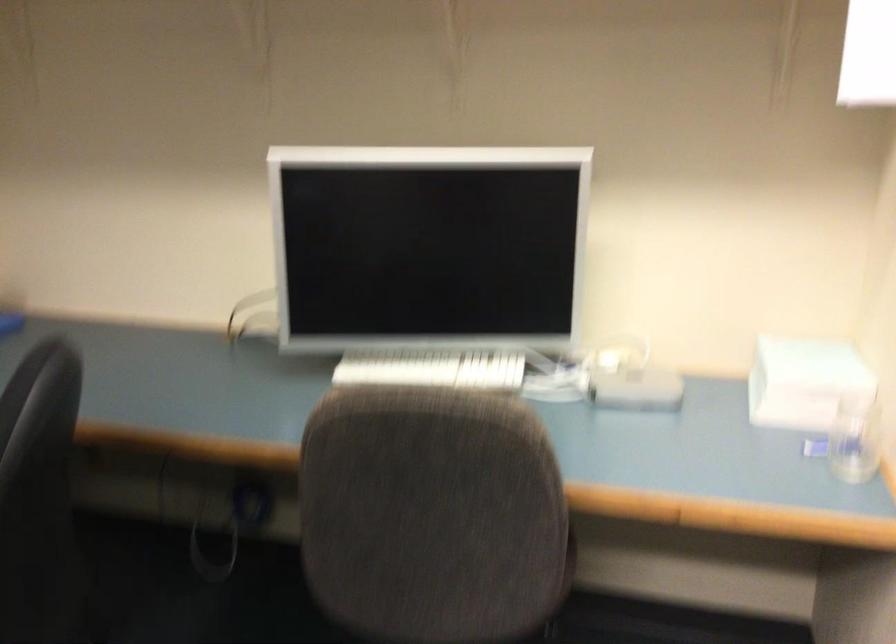
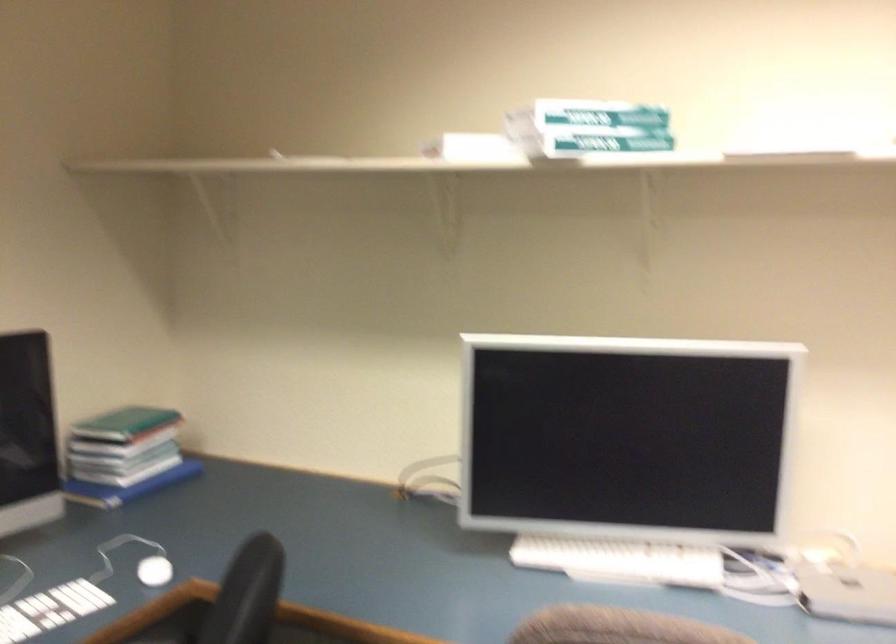
In the second image, find the point that corresponds to point 626,380 in the first image.

(846, 591)